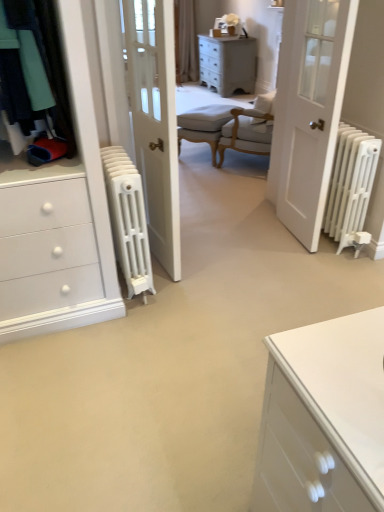
Find the location of `free location in front of white matte radiator at right`. free location in front of white matte radiator at right is located at coordinates (295, 263).